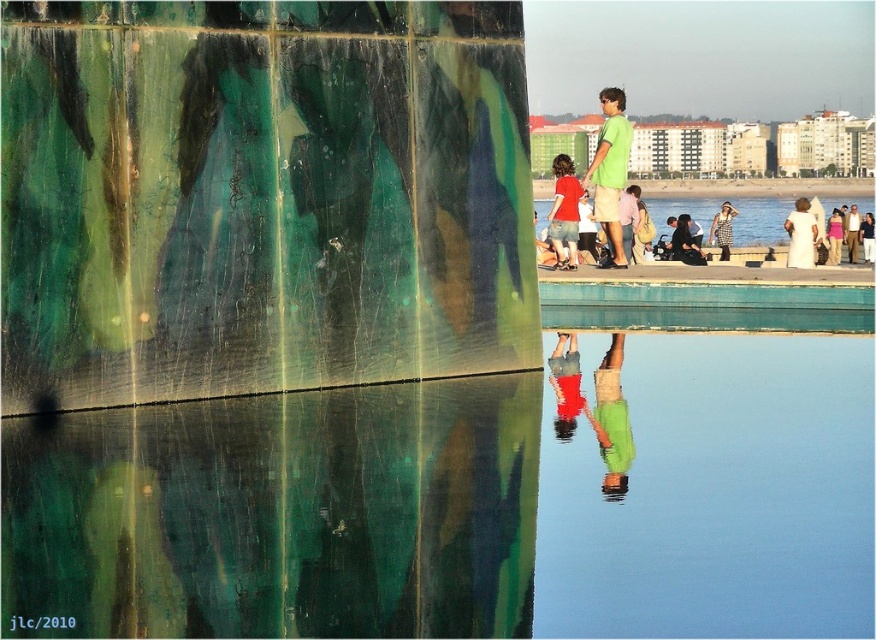
Is point (612, 432) closer to viewer compared to point (611, 228)?

Yes, point (612, 432) is closer to viewer.

Can you confirm if green marble legs at lower center is taller than green matte shirt at upper center?

In fact, green marble legs at lower center may be shorter than green matte shirt at upper center.

This screenshot has width=876, height=640. I want to click on green marble legs at lower center, so click(x=595, y=404).

Is transparent glass water at center thinner than green matte shirt at upper center?

In fact, transparent glass water at center might be wider than green matte shirt at upper center.

Is point (792, 198) behind point (615, 212)?

Yes, point (792, 198) is farther from viewer.

The height and width of the screenshot is (640, 876). Identify the location of transparent glass water at center. tap(760, 221).

Does white cotton shirt at upper right appear over khaki cotton pants at center?

Yes, white cotton shirt at upper right is above khaki cotton pants at center.

Identify the location of white cotton shirt at upper right. (800, 236).

Where is `white cotton shirt at upper right`? The height and width of the screenshot is (640, 876). white cotton shirt at upper right is located at coordinates (800, 236).